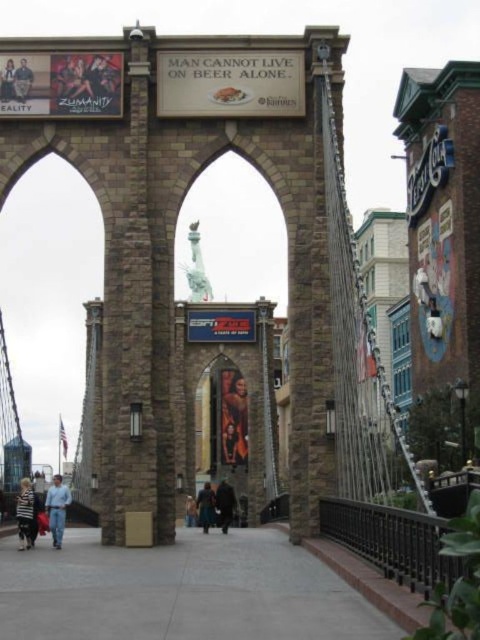
Who is taller, brown leather jacket at center or smooth black hair at upper left?

With more height is brown leather jacket at center.

Describe the element at coordinates (205, 506) in the screenshot. Image resolution: width=480 pixels, height=640 pixels. I see `brown leather jacket at center` at that location.

Image resolution: width=480 pixels, height=640 pixels. I want to click on brown leather jacket at center, so click(205, 506).

Can you confirm if smooth skin face at upper left is positioned above brown leather jacket at center?

Correct, smooth skin face at upper left is located above brown leather jacket at center.

In the scene shown: Who is lower down, smooth skin face at upper left or brown leather jacket at center?

brown leather jacket at center is below.

Is point (23, 100) closer to viewer compared to point (208, 493)?

Yes, it is.

The image size is (480, 640). What are the coordinates of `smooth skin face at upper left` in the screenshot? It's located at (23, 81).

Does blue jeans at lower left have a lesser height compared to dark brown leather coat at center?

No, blue jeans at lower left is not shorter than dark brown leather coat at center.

Who is more distant from viewer, (60, 513) or (228, 506)?

The point (228, 506) is behind.

Does point (60, 502) come behind point (228, 515)?

No, (60, 502) is closer to viewer.

Identify the location of blue jeans at lower left. Image resolution: width=480 pixels, height=640 pixels. (57, 508).